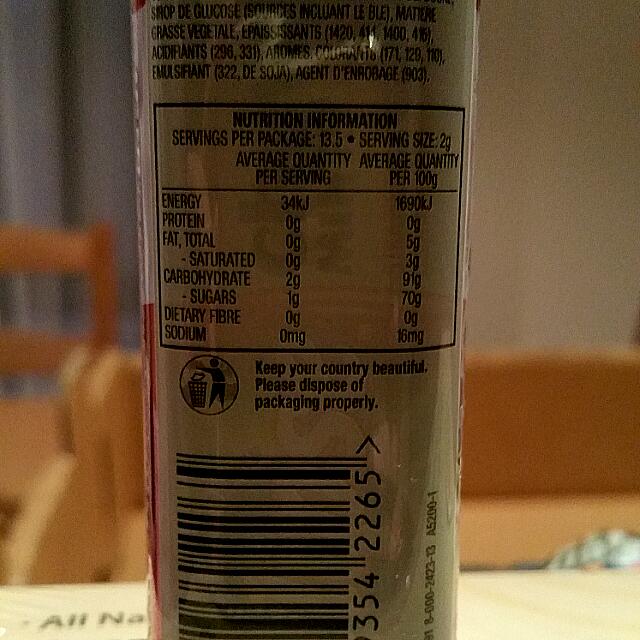
Image resolution: width=640 pixels, height=640 pixels. I want to click on back wall, so click(x=545, y=182), click(x=107, y=131).